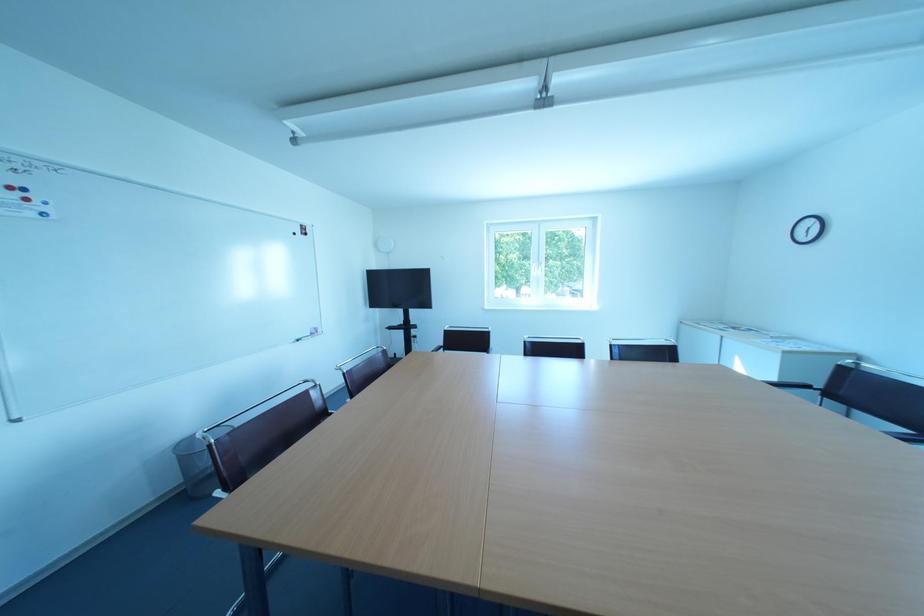
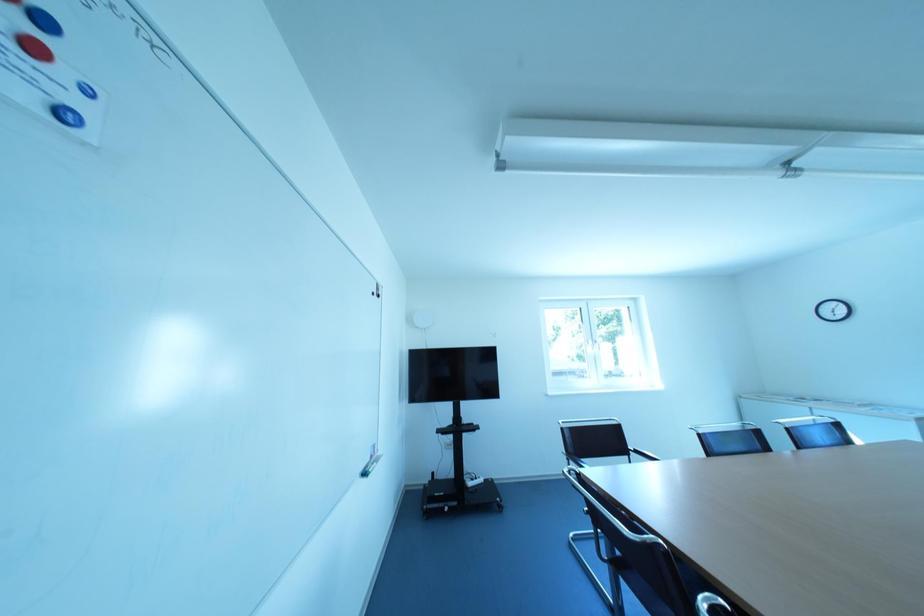
What movement of the cameraman would produce the second image?

Result: The cameraman walked toward left, forward.